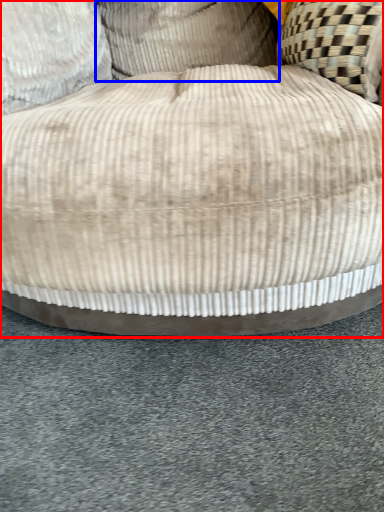
Question: Among these objects, which one is nearest to the camera, furniture (highlighted by a red box) or pillow (highlighted by a blue box)?

Choices:
 (A) furniture
 (B) pillow

Answer: (A)